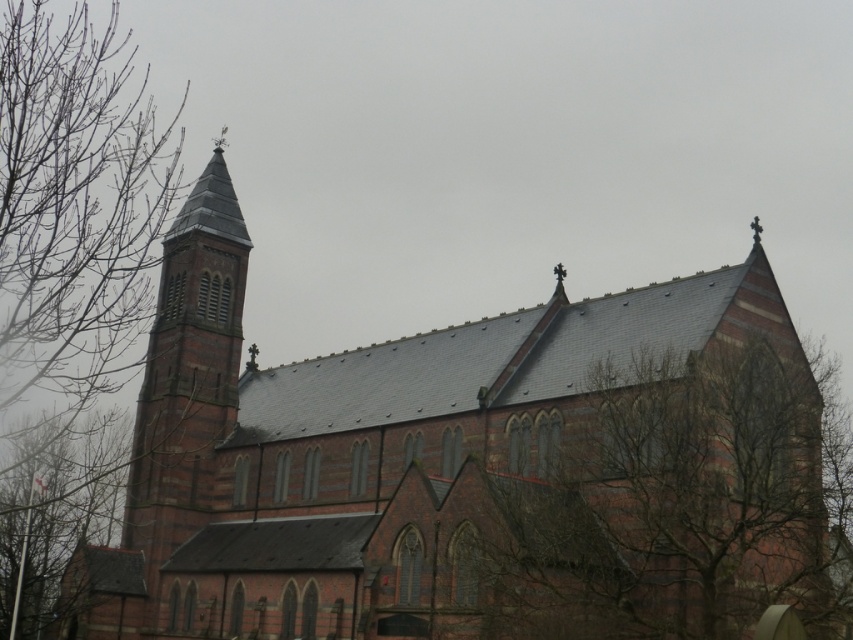
Question: Estimate the real-world distances between objects in this image. Which object is closer to the bare branches at left?

Choices:
 (A) bare branches at lower right
 (B) red brick church at center

Answer: (B)

Question: Is red brick church at center closer to camera compared to bare branches at left?

Choices:
 (A) no
 (B) yes

Answer: (B)

Question: Is red brick church at center below bare branches at left?

Choices:
 (A) no
 (B) yes

Answer: (B)

Question: Considering the real-world distances, which object is farthest from the bare branches at lower right?

Choices:
 (A) red brick church at center
 (B) bare branches at left

Answer: (B)

Question: Which of the following is the closest to the observer?

Choices:
 (A) (323, 380)
 (B) (820, 438)
 (C) (36, 532)

Answer: (B)

Question: Does red brick church at center appear on the right side of bare branches at left?

Choices:
 (A) no
 (B) yes

Answer: (B)